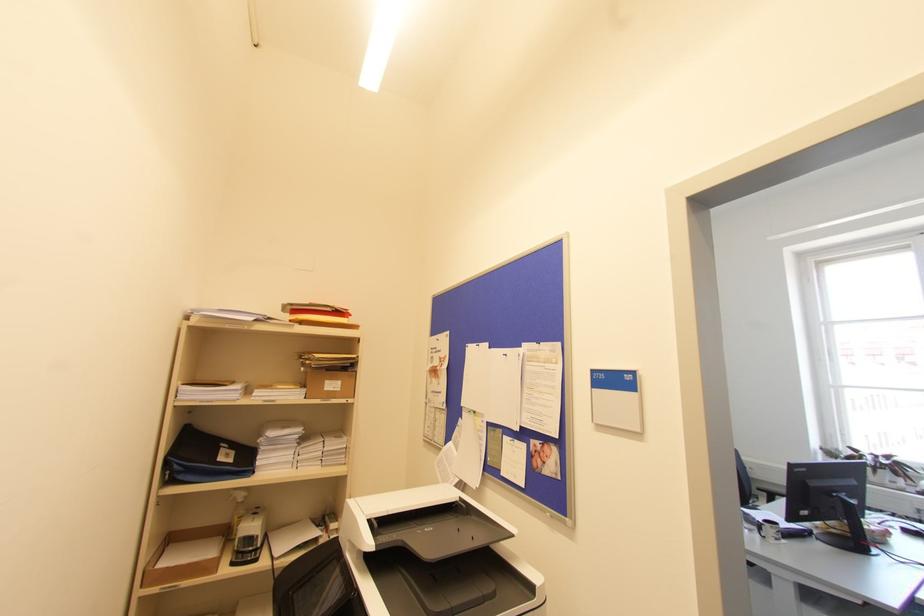
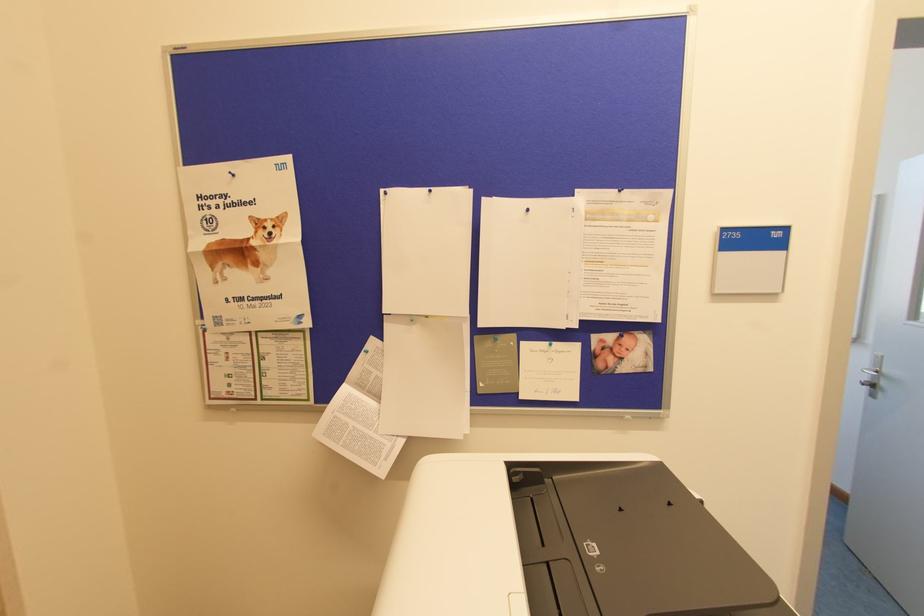
The point at (478, 345) is marked in the first image. Where is the corresponding point in the second image?

(430, 191)